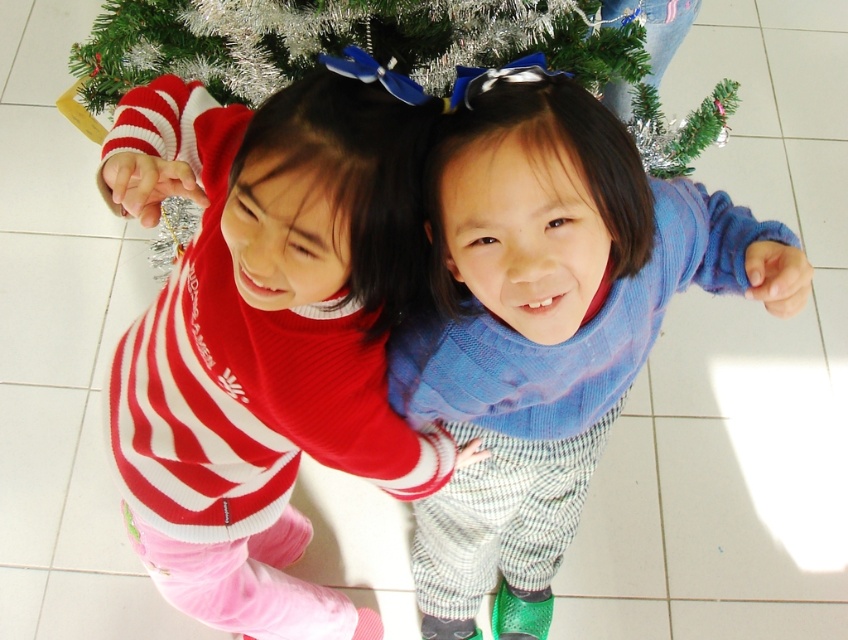
Looking at this image, you are a photographer setting up a camera at the back of the room. You need to capture both the matte red sweater at center and the green tinsel christmas tree at center in the same frame. Based on their heights, which object will appear larger in the photo?

The matte red sweater at center will appear larger in the photo because it is much taller than the green tinsel christmas tree at center.